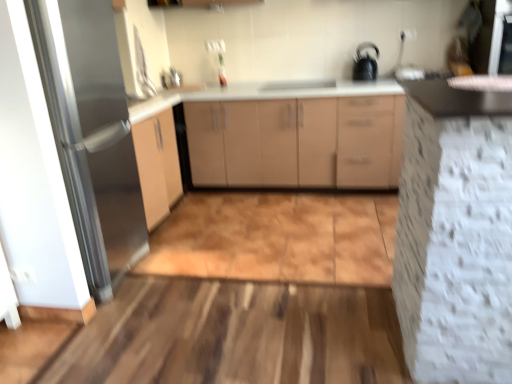
Question: Is white textured cabinet at right, which is the second cabinetry in back-to-front order, wider than black glossy kettle at upper right?

Choices:
 (A) yes
 (B) no

Answer: (A)

Question: Is white textured cabinet at right, the 1th cabinetry from the front, taller than black glossy kettle at upper right?

Choices:
 (A) no
 (B) yes

Answer: (B)

Question: From a real-world perspective, is white textured cabinet at right, which is the second cabinetry in back-to-front order, positioned under black glossy kettle at upper right based on gravity?

Choices:
 (A) no
 (B) yes

Answer: (B)

Question: Can you confirm if white textured cabinet at right, the 1th cabinetry from the front, is positioned to the right of black glossy kettle at upper right?

Choices:
 (A) yes
 (B) no

Answer: (B)

Question: Would you say black glossy kettle at upper right is part of white textured cabinet at right, which is the second cabinetry in back-to-front order,'s contents?

Choices:
 (A) no
 (B) yes

Answer: (A)

Question: Would you say matte beige cabinet at center, positioned as the second cabinetry in front-to-back order, is to the left or to the right of satin nickel faucet at upper center in the picture?

Choices:
 (A) left
 (B) right

Answer: (B)

Question: Considering the positions of matte beige cabinet at center, the 1th cabinetry when ordered from back to front, and satin nickel faucet at upper center in the image, is matte beige cabinet at center, the 1th cabinetry when ordered from back to front, wider or thinner than satin nickel faucet at upper center?

Choices:
 (A) wide
 (B) thin

Answer: (A)

Question: Considering the positions of matte beige cabinet at center, the 1th cabinetry when ordered from back to front, and satin nickel faucet at upper center in the image, is matte beige cabinet at center, the 1th cabinetry when ordered from back to front, bigger or smaller than satin nickel faucet at upper center?

Choices:
 (A) big
 (B) small

Answer: (A)

Question: From the image's perspective, is matte beige cabinet at center, positioned as the second cabinetry in front-to-back order, above or below satin nickel faucet at upper center?

Choices:
 (A) above
 (B) below

Answer: (B)

Question: Looking at the image, does satin nickel faucet at upper center seem bigger or smaller compared to white textured cabinet at right, the 1th cabinetry from the front?

Choices:
 (A) small
 (B) big

Answer: (A)

Question: Considering the positions of satin nickel faucet at upper center and white textured cabinet at right, the 1th cabinetry from the front, in the image, is satin nickel faucet at upper center taller or shorter than white textured cabinet at right, the 1th cabinetry from the front,?

Choices:
 (A) tall
 (B) short

Answer: (B)

Question: Considering the relative positions of satin nickel faucet at upper center and white textured cabinet at right, the 1th cabinetry from the front, in the image provided, is satin nickel faucet at upper center to the left or to the right of white textured cabinet at right, the 1th cabinetry from the front,?

Choices:
 (A) right
 (B) left

Answer: (B)

Question: Is satin nickel faucet at upper center wider or thinner than white textured cabinet at right, the 1th cabinetry from the front?

Choices:
 (A) thin
 (B) wide

Answer: (A)

Question: From a real-world perspective, relative to white textured cabinet at right, which is the second cabinetry in back-to-front order, is satin silver fridge at left vertically above or below?

Choices:
 (A) above
 (B) below

Answer: (A)

Question: From the image's perspective, is satin silver fridge at left located above or below white textured cabinet at right, the 1th cabinetry from the front?

Choices:
 (A) above
 (B) below

Answer: (A)